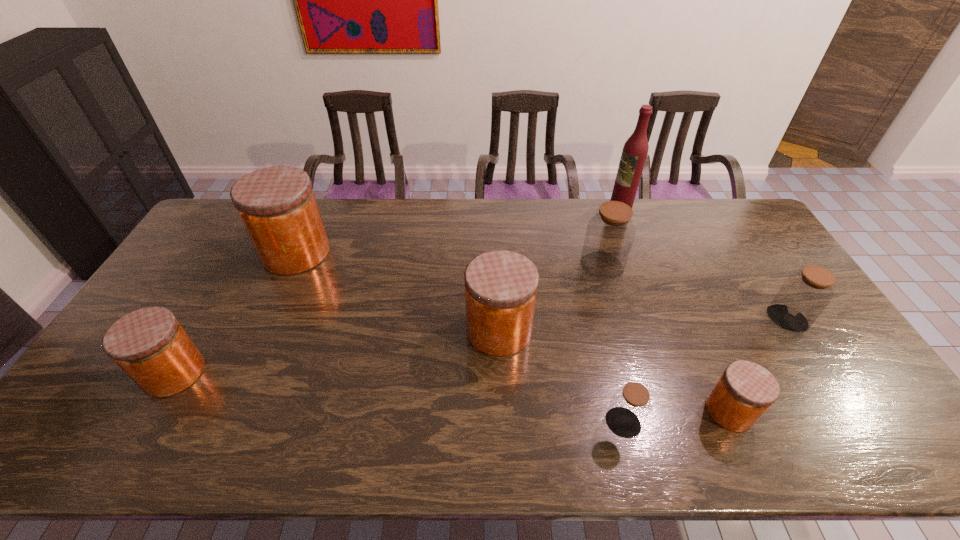
This screenshot has height=540, width=960. I want to click on vacant space situated on the right of the third biggest orange jar, so click(341, 373).

This screenshot has width=960, height=540. Find the location of `vacant region located on the left of the smallest orange jar`. vacant region located on the left of the smallest orange jar is located at coordinates (551, 411).

You are a GUI agent. You are given a task and a screenshot of the screen. Output one action in this format:
    pyautogui.click(x=<x>, y=<y>)
    Task: Click on the blank space located 0.300m on the left of the smallest brown jar
    The height and width of the screenshot is (540, 960).
    Given the screenshot: What is the action you would take?
    pyautogui.click(x=480, y=423)

Where is `liquor positioned at the far edge`? This screenshot has width=960, height=540. liquor positioned at the far edge is located at coordinates (635, 150).

Identify the location of jar at the far edge. (278, 208).

Find the location of a particular element. object at the left edge is located at coordinates (149, 344).

The width and height of the screenshot is (960, 540). What are the coordinates of `object at the right edge` in the screenshot? It's located at (803, 296).

Locate an element on the screen. This screenshot has width=960, height=540. free space at the far edge of the desktop is located at coordinates (575, 227).

What are the coordinates of `vacant space at the near edge` in the screenshot? It's located at (699, 434).

You are a GUI agent. You are given a task and a screenshot of the screen. Output one action in this format:
    pyautogui.click(x=<x>, y=<y>)
    Task: Click on the free location at the left edge
    
    Given the screenshot: What is the action you would take?
    pyautogui.click(x=164, y=294)